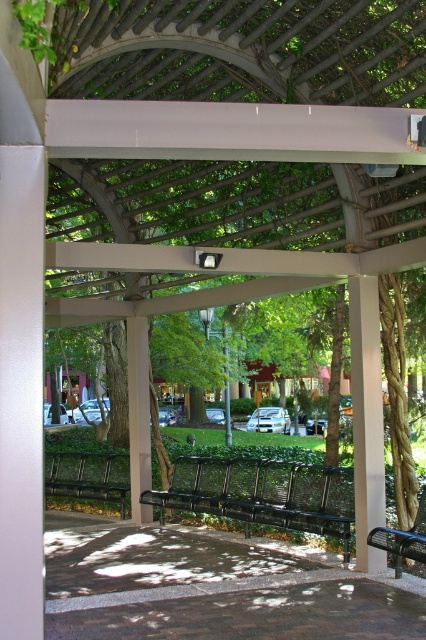
Question: Which point is farther to the camera?

Choices:
 (A) (293, 518)
 (B) (402, 536)
 (C) (77, 456)

Answer: (C)

Question: Does black mesh bench at center appear on the right side of metallic silver bench at lower right?

Choices:
 (A) no
 (B) yes

Answer: (A)

Question: Can you confirm if black mesh bench at center is positioned above metallic silver bench at lower right?

Choices:
 (A) yes
 (B) no

Answer: (B)

Question: Where is black mesh bench at center located in relation to metallic green bench at lower left in the image?

Choices:
 (A) right
 (B) left

Answer: (A)

Question: Among these points, which one is farthest from the camera?

Choices:
 (A) (230, 467)
 (B) (393, 552)

Answer: (A)

Question: Which point is farther to the camera?

Choices:
 (A) black mesh bench at center
 (B) metallic silver bench at lower right

Answer: (A)